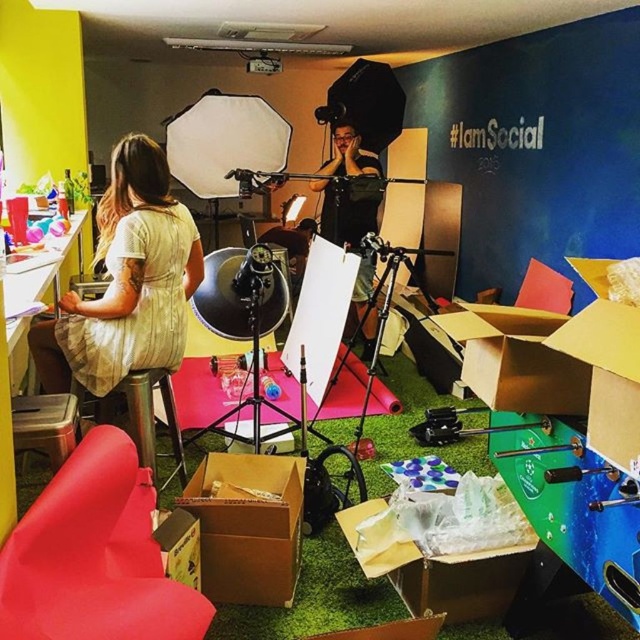
You are a photographer setting up for a photoshoot. You have a matte yellow dress at left and a matte black tripod at center in your frame. Based on their sizes, which object would require more horizontal space if you want to fully capture them in a single photo without cropping?

The matte yellow dress at left requires more horizontal space because its width surpasses that of the matte black tripod at center.

You are a photographer setting up for a photoshoot. You notice the matte yellow dress at left and the matte black tripod at center in your frame. Which object should you adjust first if you want to ensure both are in focus? Explain your reasoning based on their positions.

You should adjust the matte yellow dress at left first because it is closer to the viewer than the matte black tripod at center. To ensure both are in focus, you need to set a smaller aperture or adjust the focus point to cover the depth of field required for both distances.